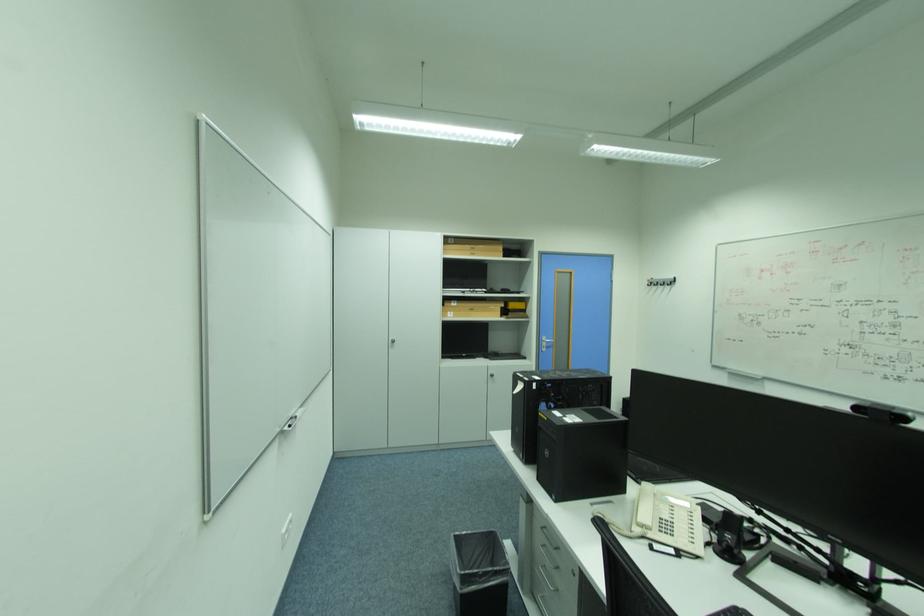
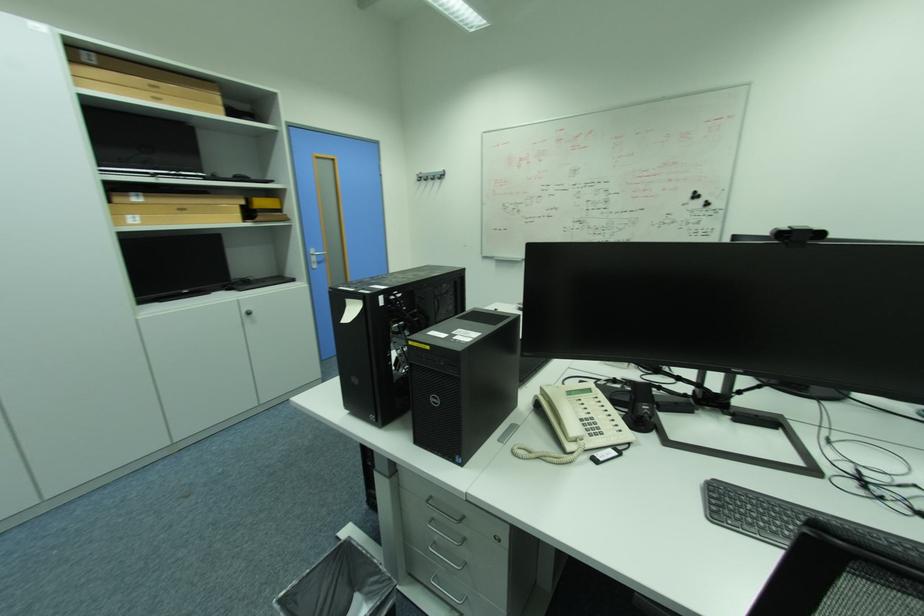
In the second image, find the point that corresponds to (x=500, y=377) in the first image.

(257, 314)